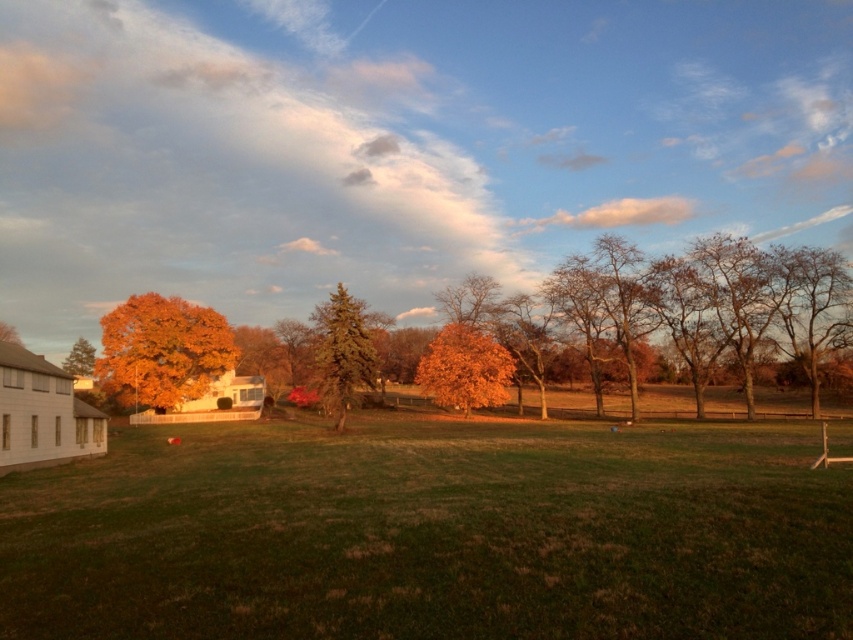
Question: Which of the following is the closest to the observer?

Choices:
 (A) (172, 353)
 (B) (479, 353)
 (C) (79, 374)
 (D) (15, 326)

Answer: (B)

Question: Can you confirm if green textured tree at center is positioned to the right of orange autumn leaves at left?

Choices:
 (A) yes
 (B) no

Answer: (A)

Question: Which point is farther to the camera?

Choices:
 (A) orange matte tree at left
 (B) orange autumn leaves at left

Answer: (A)

Question: Based on their relative distances, which object is farther from the orange autumn leaves at left?

Choices:
 (A) orange matte tree at left
 (B) green textured tree at center
 (C) orange leafy tree at left
 (D) orange leafy tree at center

Answer: (D)

Question: Is green textured tree at center closer to the viewer compared to orange autumn leaves at left?

Choices:
 (A) yes
 (B) no

Answer: (A)

Question: Is orange leafy tree at left bigger than green textured tree at center?

Choices:
 (A) no
 (B) yes

Answer: (B)